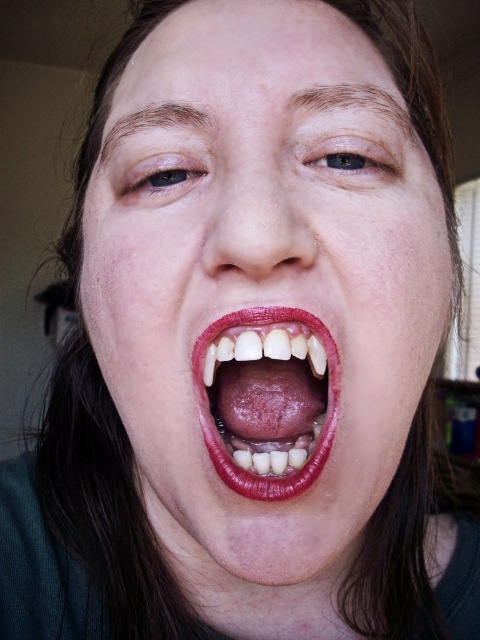
Question: Is matte skin face at center closer to camera compared to smooth skin at center?

Choices:
 (A) no
 (B) yes

Answer: (B)

Question: Which object appears closest to the camera in this image?

Choices:
 (A) matte skin face at center
 (B) smooth skin at center

Answer: (A)

Question: Observing the image, what is the correct spatial positioning of matte skin face at center in reference to smooth skin at center?

Choices:
 (A) above
 (B) below

Answer: (A)

Question: Does matte skin face at center have a smaller size compared to smooth skin at center?

Choices:
 (A) no
 (B) yes

Answer: (A)